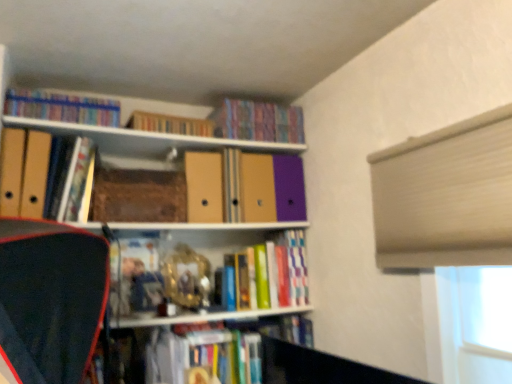
Question: Is point (228, 109) positioned closer to the camera than point (53, 96)?

Choices:
 (A) farther
 (B) closer

Answer: (A)

Question: Is matte purple book at upper center, placed as the 6th book when sorted from bottom to top, taller or shorter than hardcover books at upper left, which is the 7th book from bottom to top?

Choices:
 (A) short
 (B) tall

Answer: (B)

Question: Which object is the closest to the hardcover books at center, the second book positioned from the bottom?

Choices:
 (A) hardcover book at upper left, positioned as the fourth book in top-to-bottom order
 (B) hardcover books at upper left, which is the 7th book from bottom to top
 (C) hardcover book at upper center, the 3th book when ordered from top to bottom
 (D) matte yellow folder at left, which is counted as the first paperback book, starting from the front
 (E) hardcover book at center, which is counted as the seventh book, starting from the top

Answer: (E)

Question: Which is farther from the matte cardboard folder at center, marked as the 3th book in a bottom-to-top arrangement?

Choices:
 (A) hardcover book at center, positioned as the 1th book in bottom-to-top order
 (B) matte purple book at upper center, which ranks as the second book in top-to-bottom order
 (C) hardcover books at center, the sixth book viewed from the top
 (D) hardcover books at upper left, which is the 7th book from bottom to top
 (E) matte yellow folder at left, the 1th paperback book in the left-to-right sequence

Answer: (E)